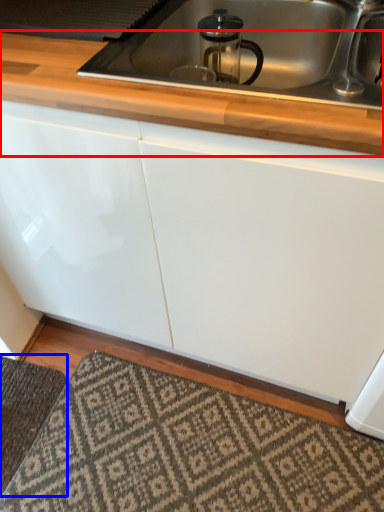
Question: Among these objects, which one is nearest to the camera, countertop (highlighted by a red box) or doormat (highlighted by a blue box)?

Choices:
 (A) countertop
 (B) doormat

Answer: (A)